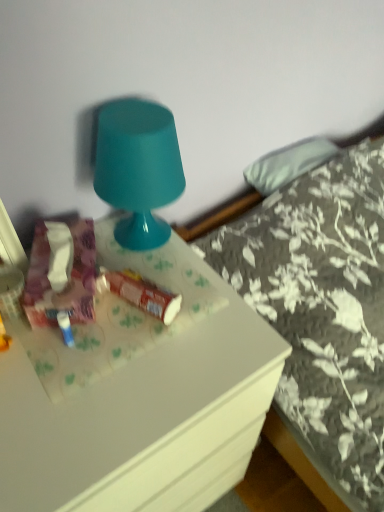
Image resolution: width=384 pixels, height=512 pixels. In order to click on free point in front of matte plastic tube at center, arranged as the first stuff when viewed from the right in this screenshot , I will do `click(124, 373)`.